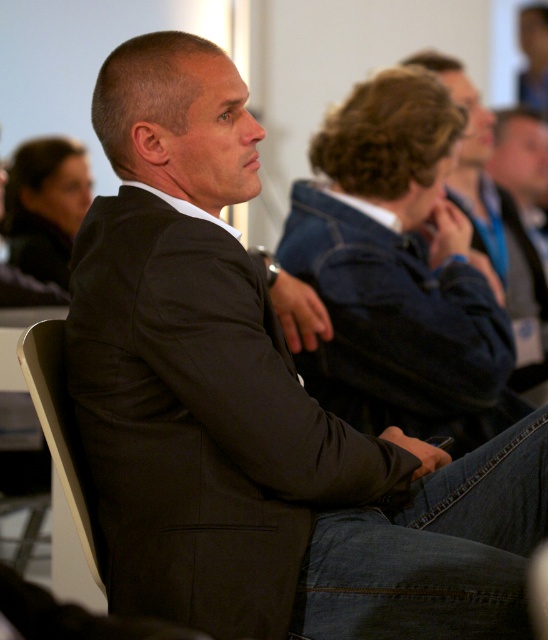
Is dark gray suit at center positioned at the back of dark blue denim jacket at upper right?

No, it is not.

Can you confirm if dark gray suit at center is bigger than dark blue denim jacket at upper right?

Incorrect, dark gray suit at center is not larger than dark blue denim jacket at upper right.

Who is more forward, (345, 371) or (465, 156)?

Point (345, 371) is more forward.

This screenshot has width=548, height=640. Find the location of `dark gray suit at center`. dark gray suit at center is located at coordinates (398, 269).